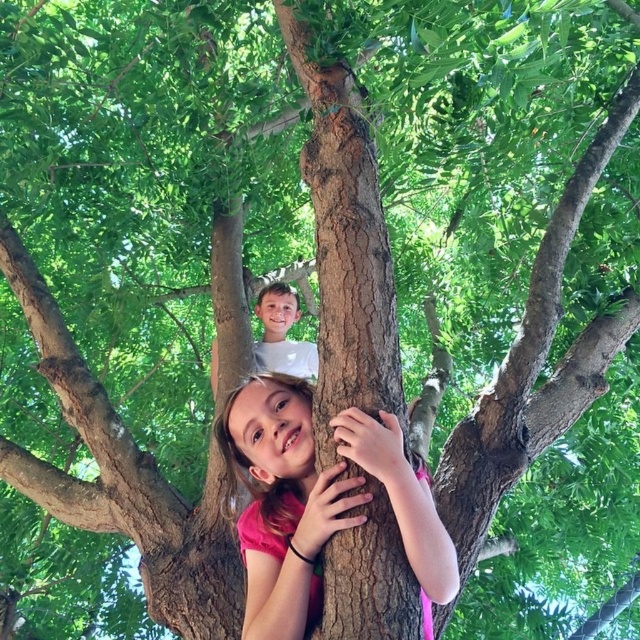
You are a photographer trying to capture a photo of both the pink matte shirt at center and the white matte shirt at upper center. Based on their positions, which one is higher up in the tree?

The pink matte shirt at center is higher up in the tree than the white matte shirt at upper center.

You are a parent watching your children play in the tree. You notice the pink matte shirt at center and the white matte shirt at upper center. Which child is closer to the ground?

The pink matte shirt at center is closer to the ground because it has a smaller size compared to the white matte shirt at upper center, indicating it is lower on the tree.

You are a parent supervising two children playing in the backyard. You see the pink matte shirt at center and the white matte shirt at upper center. How far apart are the two children?

The pink matte shirt at center and the white matte shirt at upper center are 4.75 feet apart.